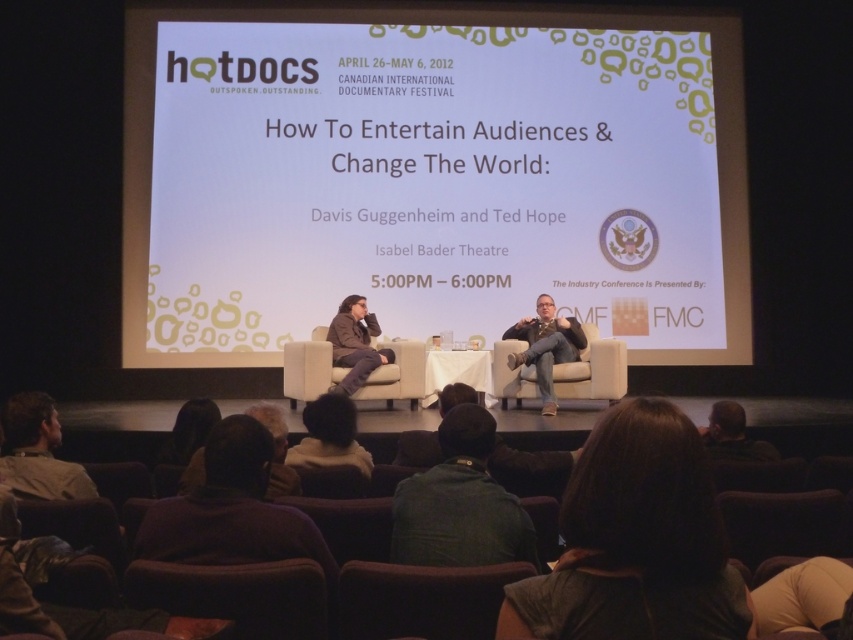
Is matte gray suit at center positioned before dark brown hair at lower right?

No.

Who is more forward, (538, 348) or (753, 445)?

Positioned in front is point (753, 445).

Does point (550, 365) come farther from viewer compared to point (709, 436)?

Yes, point (550, 365) is farther from viewer.

I want to click on matte gray suit at center, so click(544, 346).

Is point (184, 532) behind point (392, 385)?

That is False.

Measure the distance between point (216, 529) and camera.

Point (216, 529) and camera are 7.61 feet apart from each other.

What do you see at coordinates (231, 509) in the screenshot? I see `dark brown leather jacket at lower center` at bounding box center [231, 509].

The height and width of the screenshot is (640, 853). What are the coordinates of `dark brown leather jacket at lower center` in the screenshot? It's located at (231, 509).

Is point (357, 228) more distant than point (375, 396)?

That is True.

Does white fabric couch at center have a larger size compared to beige fabric chair at center?

Correct, white fabric couch at center is larger in size than beige fabric chair at center.

The image size is (853, 640). Identify the location of white fabric couch at center. (431, 177).